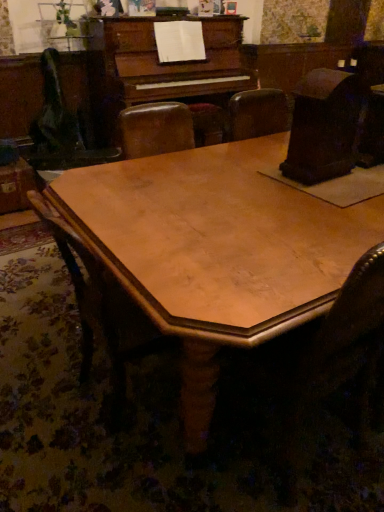
Question: Is wooden chair at center next to wooden table at center?

Choices:
 (A) no
 (B) yes

Answer: (A)

Question: From a real-world perspective, does wooden chair at center stand above wooden table at center?

Choices:
 (A) yes
 (B) no

Answer: (A)

Question: From the image's perspective, would you say wooden chair at center is shown under wooden table at center?

Choices:
 (A) no
 (B) yes

Answer: (B)

Question: Is wooden chair at center positioned far away from wooden table at center?

Choices:
 (A) yes
 (B) no

Answer: (B)

Question: Considering the relative sizes of wooden chair at center and wooden table at center in the image provided, is wooden chair at center smaller than wooden table at center?

Choices:
 (A) yes
 (B) no

Answer: (A)

Question: Is wooden chair at center further to camera compared to wooden table at center?

Choices:
 (A) no
 (B) yes

Answer: (B)

Question: Is wooden table at center further to camera compared to wooden chair at center?

Choices:
 (A) yes
 (B) no

Answer: (B)

Question: Is the position of wooden table at center less distant than that of wooden chair at center?

Choices:
 (A) no
 (B) yes

Answer: (B)

Question: From a real-world perspective, is wooden table at center on top of wooden chair at center?

Choices:
 (A) no
 (B) yes

Answer: (A)

Question: Is wooden table at center positioned beyond the bounds of wooden chair at center?

Choices:
 (A) yes
 (B) no

Answer: (A)

Question: Is wooden table at center to the left of wooden chair at center from the viewer's perspective?

Choices:
 (A) no
 (B) yes

Answer: (A)

Question: Can you confirm if wooden table at center is taller than wooden chair at center?

Choices:
 (A) no
 (B) yes

Answer: (A)

Question: From a real-world perspective, is wooden table at center above or below wooden chair at center?

Choices:
 (A) below
 (B) above

Answer: (A)